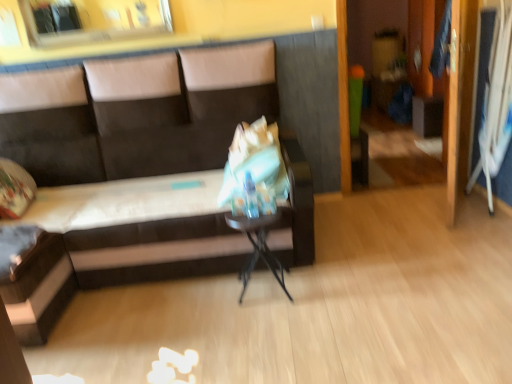
This screenshot has height=384, width=512. Identify the location of free spot in front of metallic silver table at center. (270, 325).